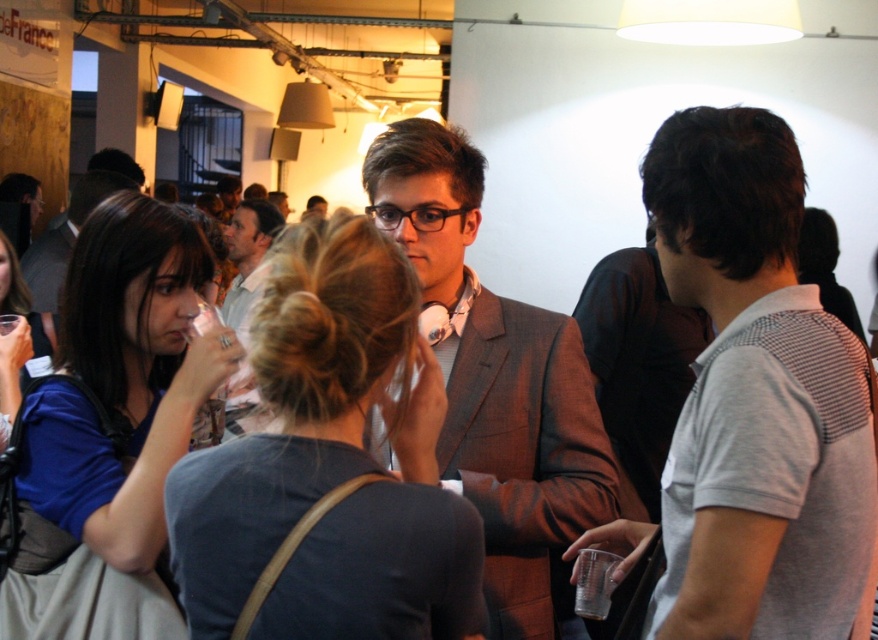
You are a photographer at the event and need to adjust your camera focus. Which object, the gray wool suit at center or the matte white shirt at center, is positioned lower in the image?

The gray wool suit at center is below the matte white shirt at center, so the gray wool suit at center is positioned lower in the image.

You are at the entrance of the venue and want to locate the gray wool suit at center. Based on the coordinates provided, in which direction should you move from your current position to find it?

The gray wool suit at center is located at coordinates point (495, 380), which is towards the center of the image. Move towards the central area of the venue to find it.